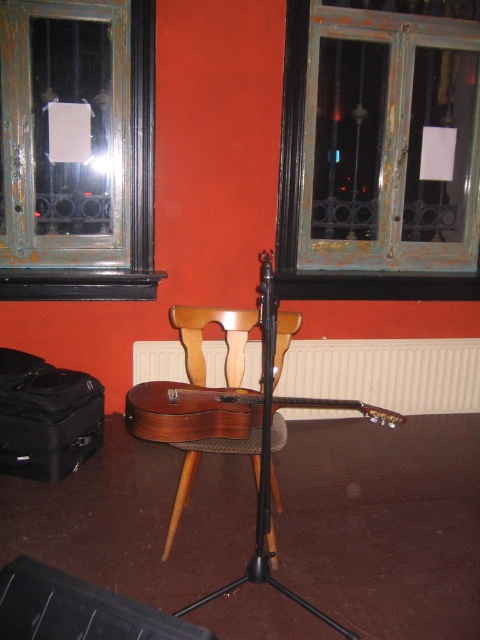
Question: Estimate the real-world distances between objects in this image. Which object is farther from the white textured radiator at center?

Choices:
 (A) wooden acoustic guitar at center
 (B) wooden chair at center

Answer: (A)

Question: Where is rusty metal window at upper left located in relation to wooden acoustic guitar at center in the image?

Choices:
 (A) above
 (B) below

Answer: (A)

Question: Considering the real-world distances, which object is closest to the white textured radiator at center?

Choices:
 (A) greenish wooden window at upper center
 (B) black matte tripod at center
 (C) wooden chair at center

Answer: (A)

Question: Which object is the closest to the black matte tripod at center?

Choices:
 (A) wooden acoustic guitar at center
 (B) greenish wooden window at upper center
 (C) wooden chair at center

Answer: (A)

Question: Is white textured radiator at center closer to the viewer compared to wooden acoustic guitar at center?

Choices:
 (A) yes
 (B) no

Answer: (B)

Question: From the image, what is the correct spatial relationship of white textured radiator at center in relation to greenish wooden window at upper center?

Choices:
 (A) left
 (B) right

Answer: (A)